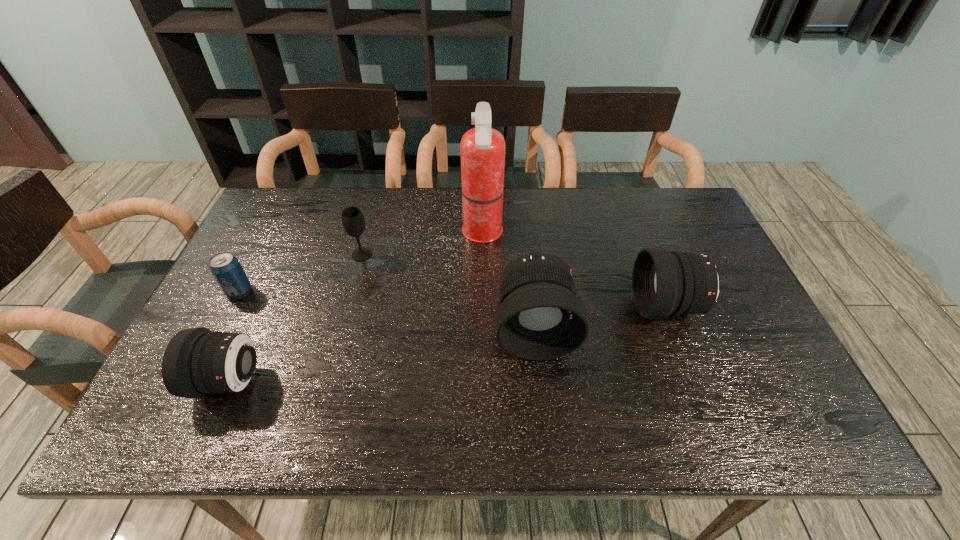
In order to click on vacant point located between the leftmost telephoto lens and the second telephoto lens from left to right in this screenshot , I will do `click(382, 355)`.

Locate an element on the screen. free point between the rightmost object and the pop soda is located at coordinates (453, 299).

Locate an element on the screen. The height and width of the screenshot is (540, 960). free space between the second shortest telephoto lens and the shortest telephoto lens is located at coordinates (448, 344).

Where is `free point between the second telephoto lens from right to left and the leftmost telephoto lens`? free point between the second telephoto lens from right to left and the leftmost telephoto lens is located at coordinates (382, 355).

Image resolution: width=960 pixels, height=540 pixels. I want to click on free point between the rightmost object and the pop soda, so click(453, 299).

Where is `free spot between the fire extinguisher and the leftmost telephoto lens`? The width and height of the screenshot is (960, 540). free spot between the fire extinguisher and the leftmost telephoto lens is located at coordinates (356, 307).

At what (x,y) coordinates should I click in order to perform the action: click on vacant area that lies between the fire extinguisher and the fourth object from right to left. Please return your answer as a coordinate pair (x, y). The height and width of the screenshot is (540, 960). Looking at the image, I should click on (422, 244).

Locate an element on the screen. Image resolution: width=960 pixels, height=540 pixels. empty space that is in between the fire extinguisher and the third object from left to right is located at coordinates (422, 244).

You are a GUI agent. You are given a task and a screenshot of the screen. Output one action in this format:
    pyautogui.click(x=<x>, y=<y>)
    Task: Click on the object that is the closest to the second tallest telephoto lens
    Image resolution: width=960 pixels, height=540 pixels.
    Given the screenshot: What is the action you would take?
    pyautogui.click(x=540, y=317)

Select which object is the third closest to the wineglass. Please provide its 2D coordinates. Your answer should be formatted as a tuple, i.e. [(x, y)], where the tuple contains the x and y coordinates of a point satisfying the conditions above.

[(197, 361)]